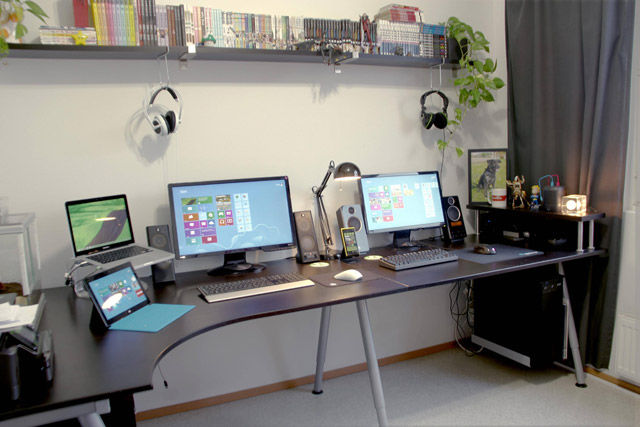
The height and width of the screenshot is (427, 640). I want to click on laptop, so click(105, 209).